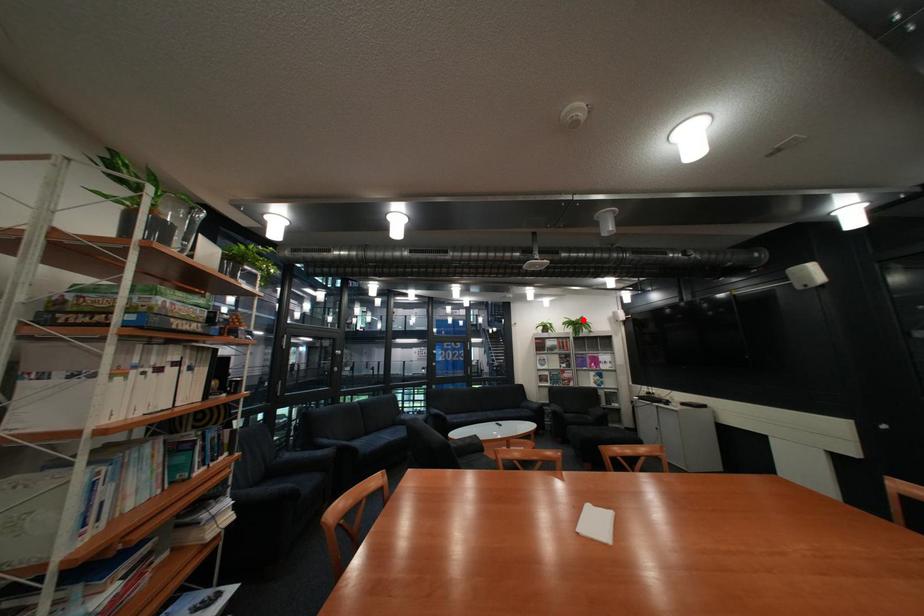
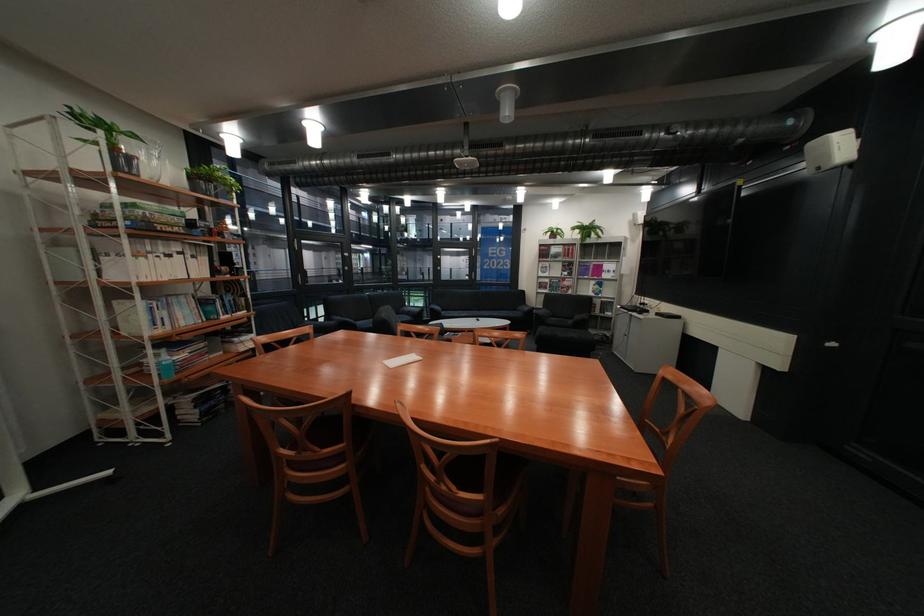
Question: I am providing you with two images of the same scene from different viewpoints. Image1 has a red point marked. In image2, the corresponding 3D location appears at what relative position? Reply with the corresponding letter.

Choices:
 (A) Closer
 (B) Farther

Answer: (A)